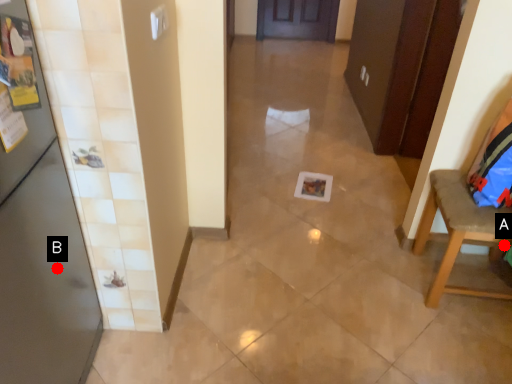
Question: Two points are circled on the image, labeled by A and B beside each circle. Which point is farther to the camera?

Choices:
 (A) A is further
 (B) B is further

Answer: (A)